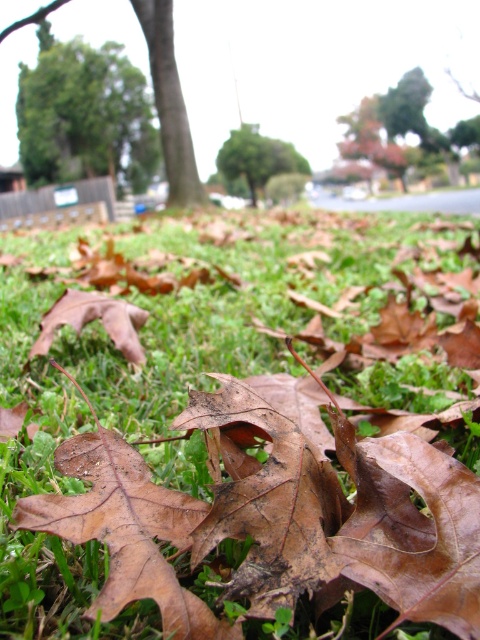
You are a photographer adjusting your camera focus. You want to focus on both the point at (x=156, y=512) and the point at (x=129, y=115). Which point should you focus on first to ensure the closest object is sharp?

You should focus on point (x=156, y=512) first because it is closer to the camera than point (x=129, y=115), ensuring the closest object is in sharp focus.

Consider the image. You are standing in the grassy area and want to take a photo of the green leafy tree at upper left and the green leafy tree at center. Which tree will appear smaller in the photo?

The green leafy tree at center will appear smaller in the photo because it is farther away from you than the green leafy tree at upper left.

You are standing in the grassy area and want to place a small garden ornament. The ornament requires a spot that is both stable and not overshadowed by the tree. Considering the sizes of the green matte grass at center and the green leafy tree at upper left, where should you place it?

The green matte grass at center has a smaller size compared to the green leafy tree at upper left, so placing the ornament on the green matte grass at center would provide a stable base while keeping it from being overshadowed by the larger tree.